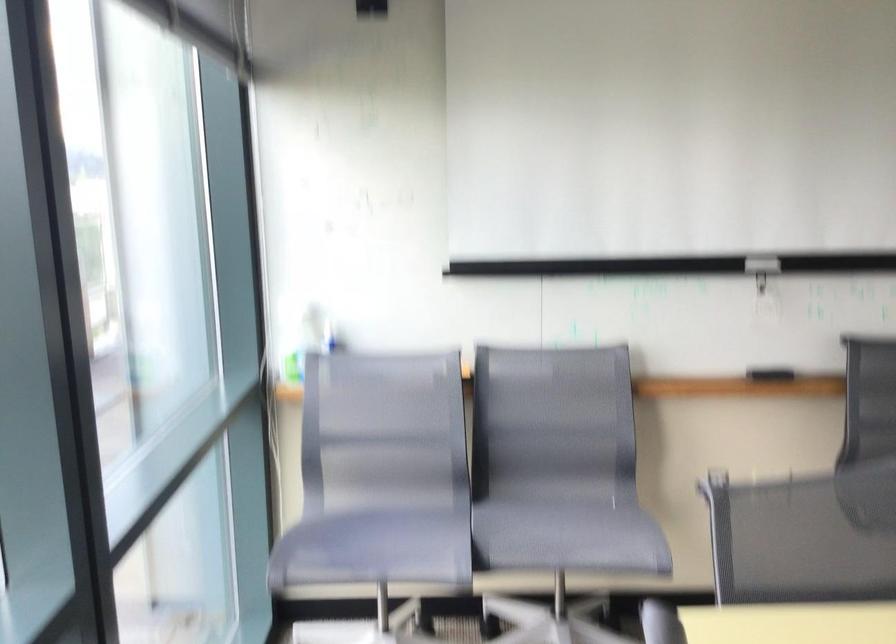
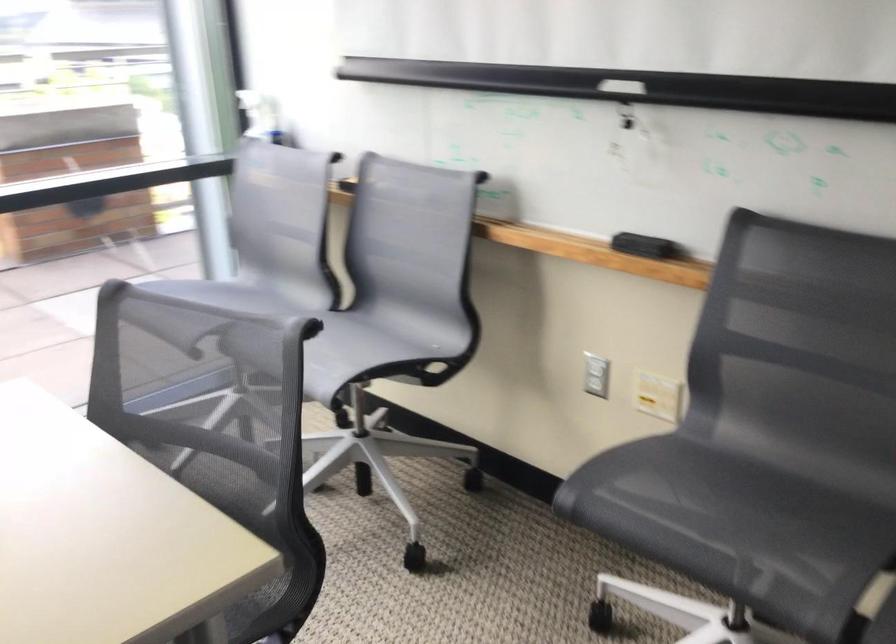
Where in the second image is the point corresponding to point 600,355 from the first image?

(457, 182)